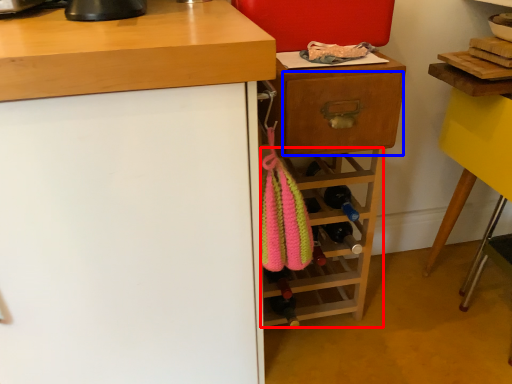
Question: Which object is further to the camera taking this photo, shelf (highlighted by a red box) or drawer (highlighted by a blue box)?

Choices:
 (A) shelf
 (B) drawer

Answer: (A)